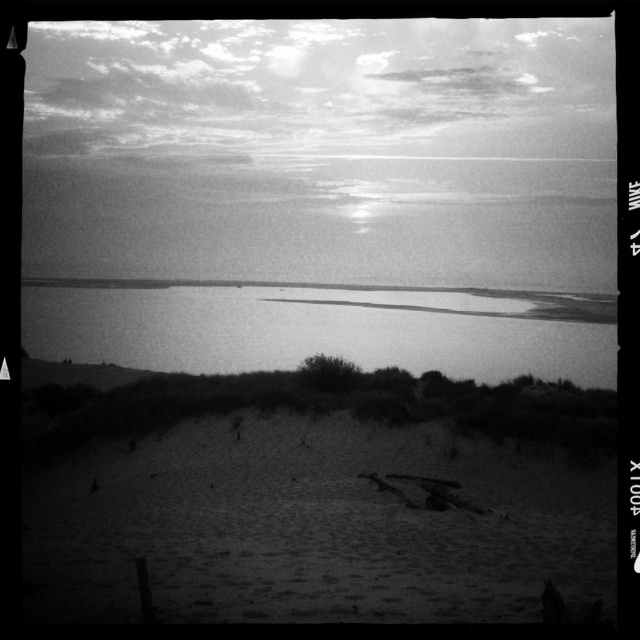
Is smooth sand at lower center positioned at the back of smooth water at center?

No, it is in front of smooth water at center.

Does point (128, 472) lie behind point (376, 356)?

No.

Between point (476, 596) and point (308, 342), which one is positioned behind?

Positioned behind is point (308, 342).

This screenshot has width=640, height=640. What are the coordinates of `smooth sand at lower center` in the screenshot? It's located at (314, 525).